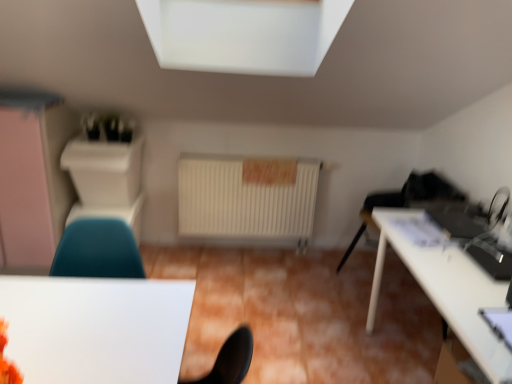
Question: From a real-world perspective, is matte white dresser at left beneath teal fabric chair at lower left?

Choices:
 (A) no
 (B) yes

Answer: (A)

Question: Is matte white dresser at left to the right of teal fabric chair at lower left from the viewer's perspective?

Choices:
 (A) no
 (B) yes

Answer: (A)

Question: Can you confirm if matte white dresser at left is positioned to the left of teal fabric chair at lower left?

Choices:
 (A) yes
 (B) no

Answer: (A)

Question: Can you confirm if matte white dresser at left is thinner than teal fabric chair at lower left?

Choices:
 (A) no
 (B) yes

Answer: (A)

Question: Considering the relative sizes of matte white dresser at left and teal fabric chair at lower left in the image provided, is matte white dresser at left taller than teal fabric chair at lower left?

Choices:
 (A) yes
 (B) no

Answer: (A)

Question: Does matte white dresser at left have a lesser height compared to teal fabric chair at lower left?

Choices:
 (A) no
 (B) yes

Answer: (A)

Question: Is white glossy table at right, which appears as the 1th table when viewed from the right, further to camera compared to matte white dresser at left?

Choices:
 (A) yes
 (B) no

Answer: (B)

Question: Are white glossy table at right, the second table positioned from the left, and matte white dresser at left making contact?

Choices:
 (A) no
 (B) yes

Answer: (A)

Question: From a real-world perspective, is white glossy table at right, the second table positioned from the left, positioned under matte white dresser at left based on gravity?

Choices:
 (A) no
 (B) yes

Answer: (B)

Question: Does white glossy table at right, the second table positioned from the left, appear on the right side of matte white dresser at left?

Choices:
 (A) yes
 (B) no

Answer: (A)

Question: Does white glossy table at right, which appears as the 1th table when viewed from the right, have a greater width compared to matte white dresser at left?

Choices:
 (A) no
 (B) yes

Answer: (B)

Question: Is white glossy table at right, which appears as the 1th table when viewed from the right, positioned far away from matte white dresser at left?

Choices:
 (A) yes
 (B) no

Answer: (A)

Question: Is white glossy table at lower left, the 2th table from the right, placed right next to matte white dresser at left?

Choices:
 (A) no
 (B) yes

Answer: (A)